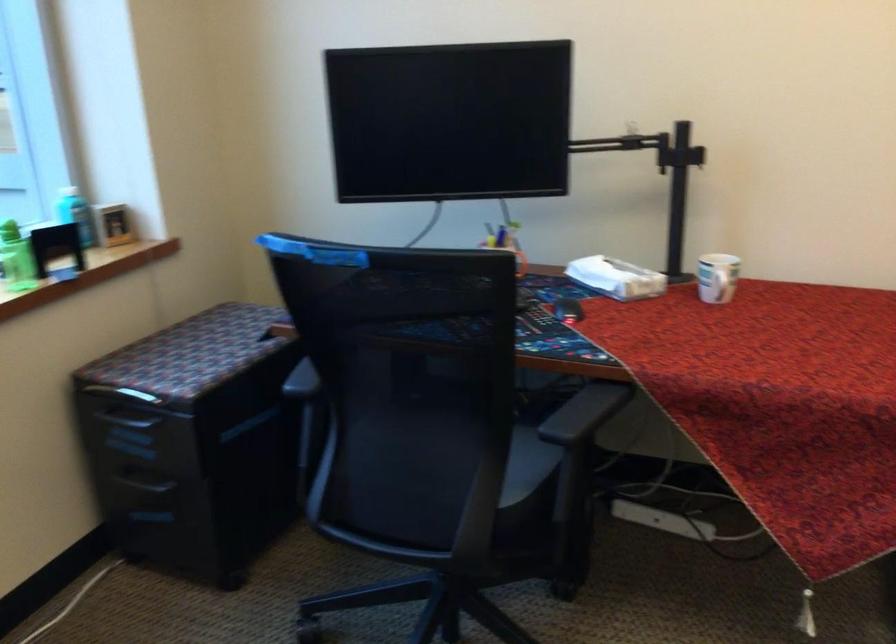
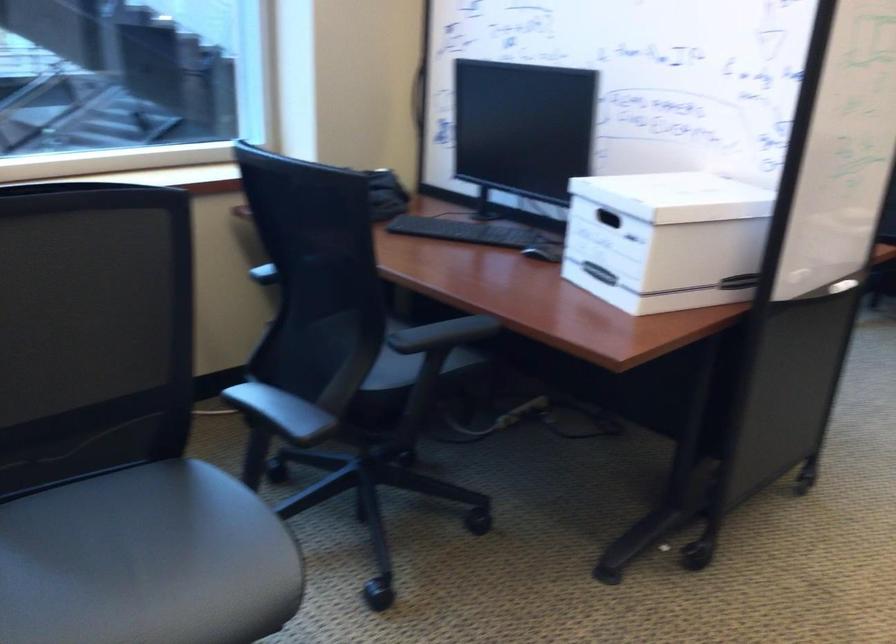
Question: I am providing you with two images of the same scene from different viewpoints. Which of the following objects are not visible in image2?

Choices:
 (A) cabinet drawer handle
 (B) box handle cutout
 (C) black chair sitting surface
 (D) metal canister

Answer: (A)